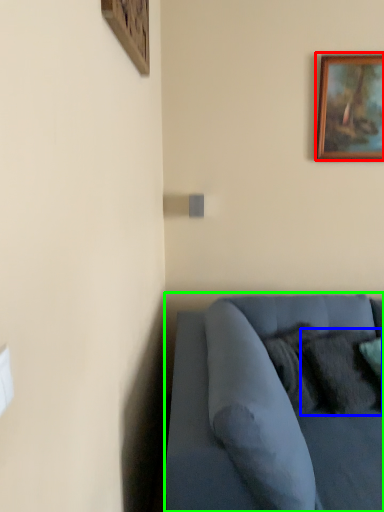
Question: Which object is the closest to the picture frame (highlighted by a red box)? Choose among these: pillow (highlighted by a blue box) or studio couch (highlighted by a green box).

Choices:
 (A) pillow
 (B) studio couch

Answer: (A)